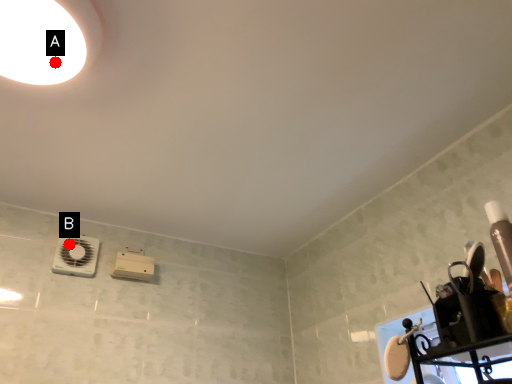
Question: Two points are circled on the image, labeled by A and B beside each circle. Which point is further to the camera?

Choices:
 (A) A is further
 (B) B is further

Answer: (B)